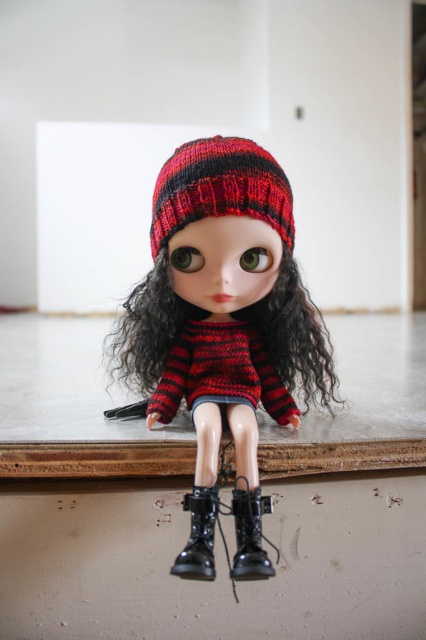
Does knitted woolen hat at center appear on the left side of black leather boots at lower center?

Correct, you'll find knitted woolen hat at center to the left of black leather boots at lower center.

Is knitted woolen hat at center in front of black leather boots at lower center?

No, it is not.

The image size is (426, 640). Describe the element at coordinates (222, 304) in the screenshot. I see `knitted woolen hat at center` at that location.

This screenshot has width=426, height=640. Identify the location of knitted woolen hat at center. (222, 304).

Between knitted woolen hat at center and knitted red and black sweater at center, which one is positioned lower?

knitted red and black sweater at center is lower down.

Where is `knitted woolen hat at center`? The image size is (426, 640). knitted woolen hat at center is located at coordinates (222, 304).

The width and height of the screenshot is (426, 640). What are the coordinates of `knitted woolen hat at center` in the screenshot? It's located at (222, 304).

Does knitted woolen beanie at center appear on the right side of black leather boots at lower center?

No, knitted woolen beanie at center is not to the right of black leather boots at lower center.

Which is above, knitted woolen beanie at center or black leather boots at lower center?

knitted woolen beanie at center

Identify the location of knitted woolen beanie at center. The width and height of the screenshot is (426, 640). (219, 188).